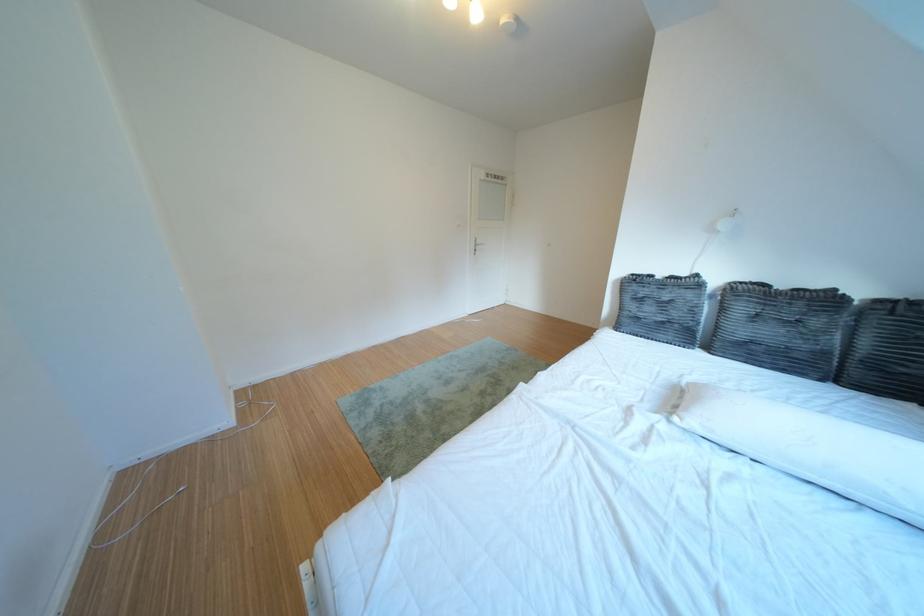
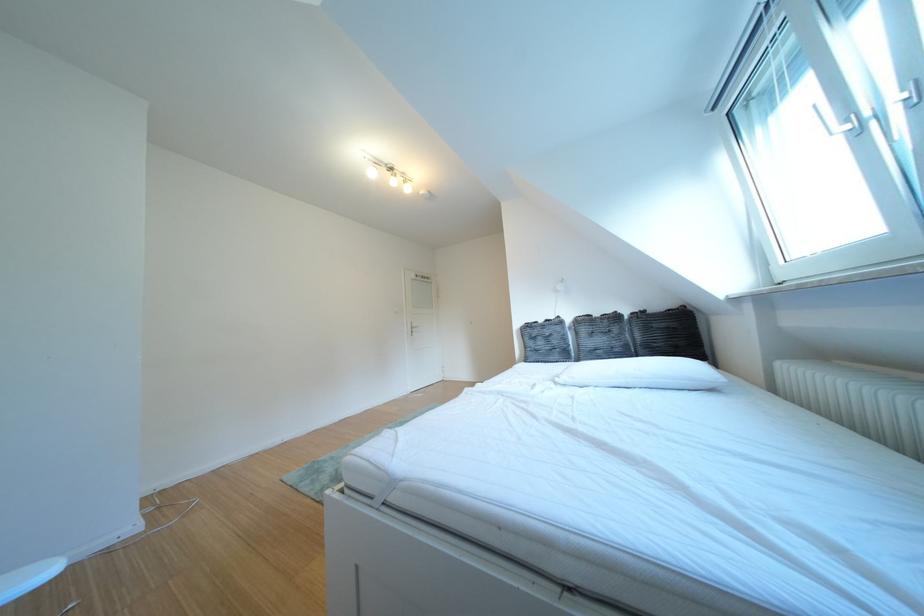
The images are taken continuously from a first-person perspective. In which direction is your viewpoint rotating?

The camera rotated toward right-up.